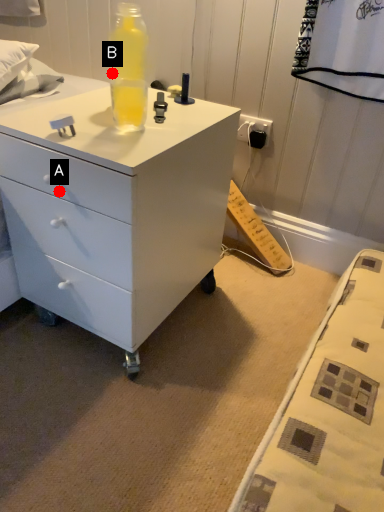
Question: Two points are circled on the image, labeled by A and B beside each circle. Which point is farther to the camera?

Choices:
 (A) A is further
 (B) B is further

Answer: (B)